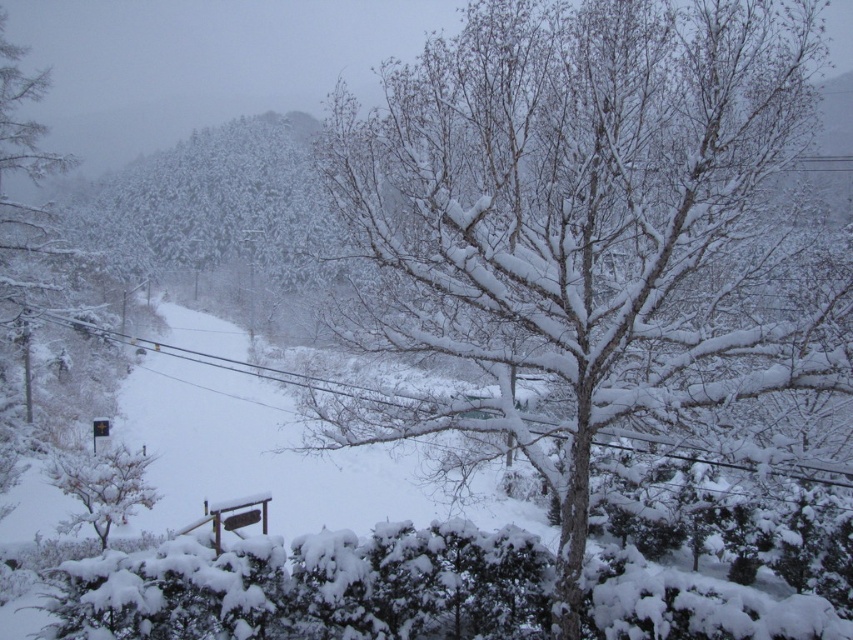
You are standing at the point with coordinates point (807, 380) and want to walk towards the point with coordinates point (134, 456). Given the snowy terrain described in the scene, will you be walking uphill or downhill?

Since point (807, 380) is in front of point (134, 456), it means you are already ahead in the direction of point (134, 456). Therefore, you would be walking downhill towards it.